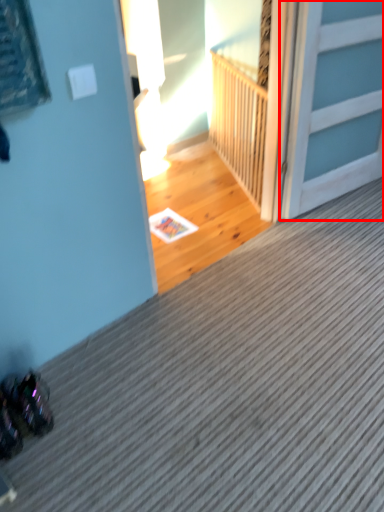
Question: From the image's perspective, what is the correct spatial positioning of door (annotated by the red box) in reference to balustrade?

Choices:
 (A) below
 (B) above

Answer: (A)